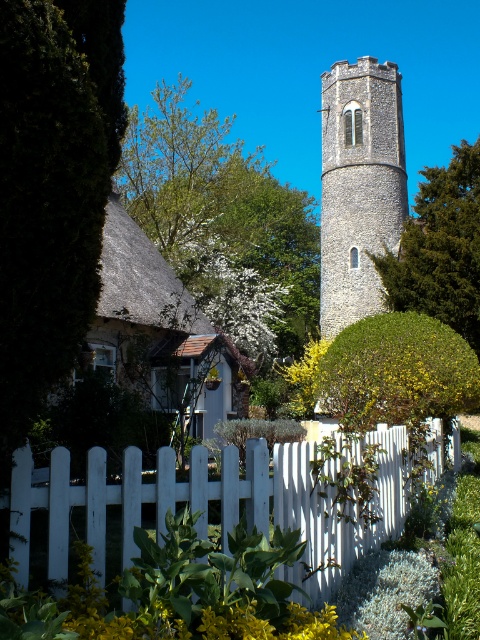
You are standing in front of the scene and want to know which object is narrower between the dark green leafy tree at left and the white picket fence at lower center. Can you determine this?

The dark green leafy tree at left has a lesser width compared to the white picket fence at lower center, so the dark green leafy tree at left is narrower.

You are standing at the point marked as point (x=51, y=189) in the image. What object is exactly at your current location?

The dark green leafy tree at left is located at point (x=51, y=189).